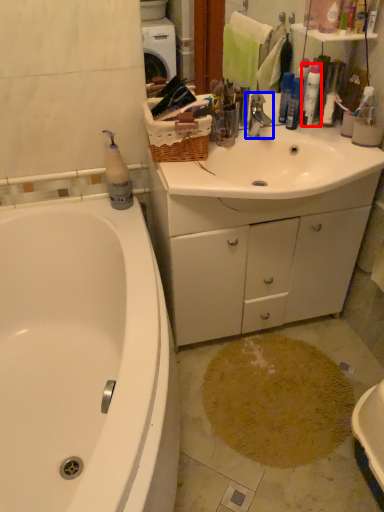
Question: Among these objects, which one is nearest to the camera, cleaning product (highlighted by a red box) or tap (highlighted by a blue box)?

Choices:
 (A) cleaning product
 (B) tap

Answer: (B)